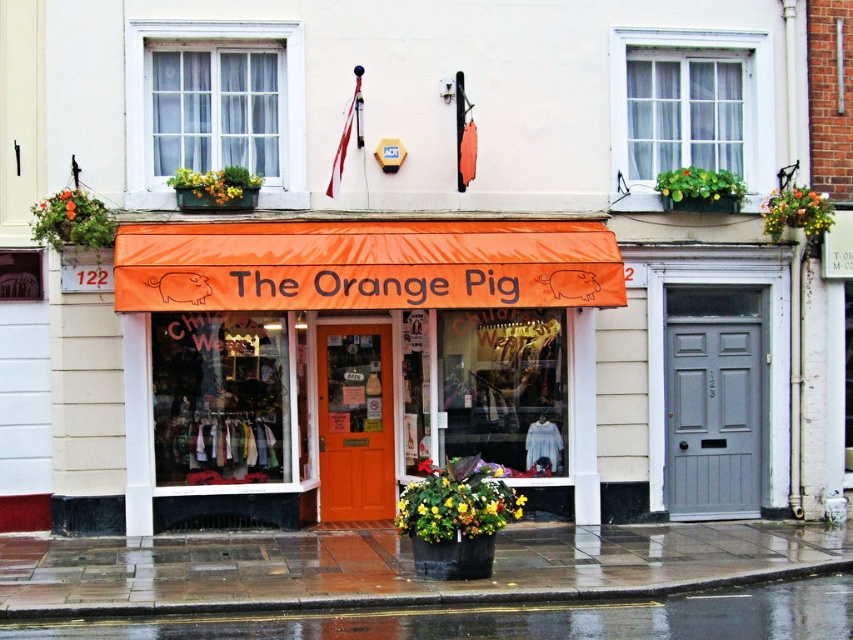
Question: Observing the image, what is the correct spatial positioning of orange fabric awning at center in reference to white glass window at upper center?

Choices:
 (A) below
 (B) above

Answer: (A)

Question: Can you confirm if orange fabric awning at center is bigger than wet asphalt at lower left?

Choices:
 (A) no
 (B) yes

Answer: (B)

Question: Which object appears closest to the camera in this image?

Choices:
 (A) white glass window at upper center
 (B) orange fabric awning at center

Answer: (B)

Question: Is wet concrete pavement at lower center bigger than wet asphalt at lower left?

Choices:
 (A) yes
 (B) no

Answer: (B)

Question: Among these points, which one is farthest from the camera?

Choices:
 (A) (1, 541)
 (B) (851, 627)
 (C) (225, 77)
 (D) (474, 264)

Answer: (C)

Question: Considering the real-world distances, which object is farthest from the wet asphalt at lower left?

Choices:
 (A) orange fabric awning at center
 (B) white glass window at upper center
 (C) wet concrete pavement at lower center

Answer: (B)